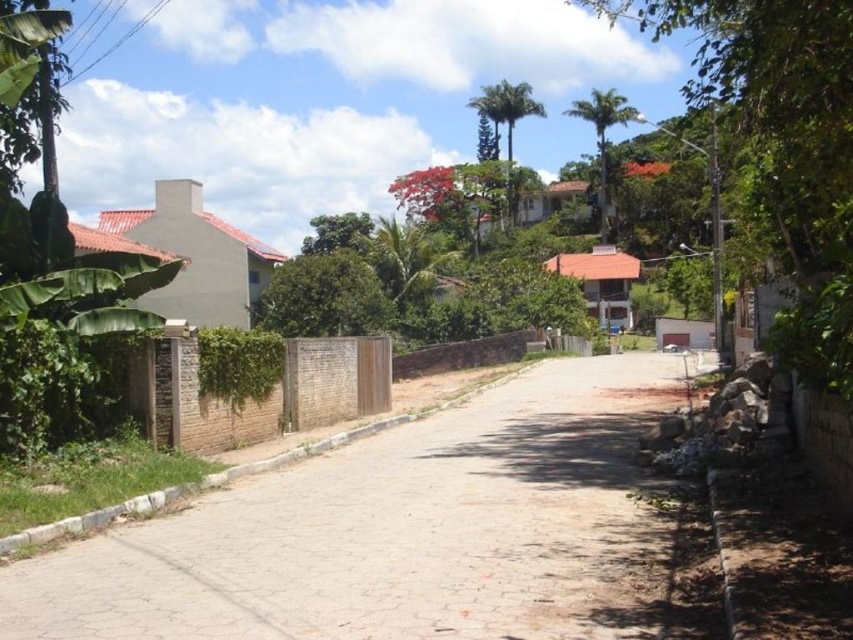
Question: Which point is farther from the camera taking this photo?

Choices:
 (A) (445, 541)
 (B) (590, 96)
 (C) (514, 90)

Answer: (B)

Question: Does dirt road at center appear over green leafy palm tree at upper center?

Choices:
 (A) no
 (B) yes

Answer: (A)

Question: Can you confirm if green leafy tree at upper right is positioned to the left of green leafy palm tree at center?

Choices:
 (A) no
 (B) yes

Answer: (A)

Question: Estimate the real-world distances between objects in this image. Which object is closer to the green leafy tree at upper right?

Choices:
 (A) green leafy palm tree at center
 (B) dirt road at center
 (C) green leafy palm tree at upper center

Answer: (B)

Question: Which point is farther to the camera?

Choices:
 (A) green leafy palm tree at center
 (B) green leafy palm tree at upper center
 (C) dirt road at center
 (D) green leafy tree at upper right

Answer: (A)

Question: Can you confirm if dirt road at center is smaller than green leafy tree at upper right?

Choices:
 (A) no
 (B) yes

Answer: (B)